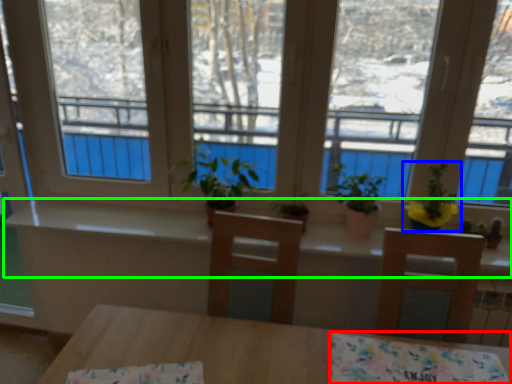
Question: Which object is positioned farthest from tablecloth (highlighted by a red box)? Select from houseplant (highlighted by a blue box) and counter top (highlighted by a green box).

Choices:
 (A) houseplant
 (B) counter top

Answer: (B)